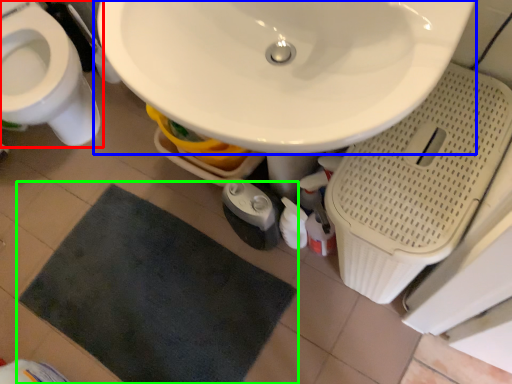
Question: Estimate the real-world distances between objects in this image. Which object is farther from toilet (highlighted by a red box), sink (highlighted by a blue box) or bath mat (highlighted by a green box)?

Choices:
 (A) sink
 (B) bath mat

Answer: (A)